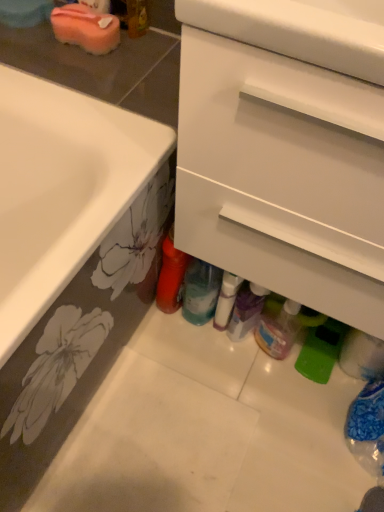
Question: In which direction should I rotate to look at white glossy bottle at center, placed as the 2th bottle when sorted from right to left?

Choices:
 (A) left
 (B) right

Answer: (B)

Question: Is the position of translucent plastic bottles at lower center more distant than that of white matte drawer at center?

Choices:
 (A) no
 (B) yes

Answer: (B)

Question: Considering the relative sizes of translucent plastic bottles at lower center and white matte drawer at center in the image provided, is translucent plastic bottles at lower center shorter than white matte drawer at center?

Choices:
 (A) no
 (B) yes

Answer: (B)

Question: Is translucent plastic bottles at lower center oriented away from white matte drawer at center?

Choices:
 (A) yes
 (B) no

Answer: (B)

Question: Is translucent plastic bottles at lower center to the left of white matte drawer at center from the viewer's perspective?

Choices:
 (A) no
 (B) yes

Answer: (B)

Question: Is translucent plastic bottles at lower center bigger than white matte drawer at center?

Choices:
 (A) yes
 (B) no

Answer: (B)

Question: Is translucent plastic bottles at lower center not inside white matte drawer at center?

Choices:
 (A) no
 (B) yes

Answer: (B)

Question: Is pink sponge at upper left facing away from translucent plastic bottle at center, which is the fourth bottle in right-to-left order?

Choices:
 (A) no
 (B) yes

Answer: (A)

Question: Does pink sponge at upper left appear on the right side of translucent plastic bottle at center, the first bottle positioned from the left?

Choices:
 (A) no
 (B) yes

Answer: (A)

Question: Is pink sponge at upper left positioned far away from translucent plastic bottle at center, the first bottle positioned from the left?

Choices:
 (A) yes
 (B) no

Answer: (B)

Question: Can you confirm if pink sponge at upper left is bigger than translucent plastic bottle at center, the first bottle positioned from the left?

Choices:
 (A) yes
 (B) no

Answer: (B)

Question: Is pink sponge at upper left wider than translucent plastic bottle at center, which is the fourth bottle in right-to-left order?

Choices:
 (A) no
 (B) yes

Answer: (A)

Question: Considering the relative sizes of pink sponge at upper left and translucent plastic bottle at center, which is the fourth bottle in right-to-left order, in the image provided, is pink sponge at upper left shorter than translucent plastic bottle at center, which is the fourth bottle in right-to-left order,?

Choices:
 (A) no
 (B) yes

Answer: (B)

Question: Is translucent plastic bottle at lower center, which is counted as the first bottle, starting from the right, bigger than pink sponge at upper left?

Choices:
 (A) no
 (B) yes

Answer: (B)